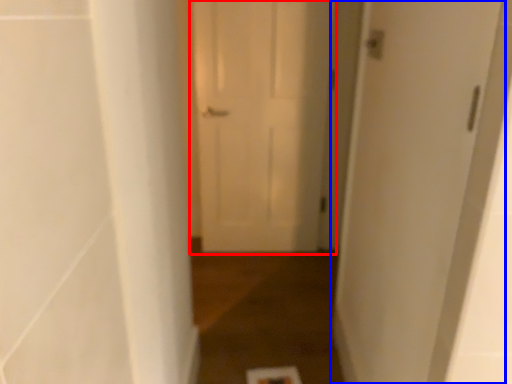
Question: Which point is further to the camera, door (highlighted by a red box) or door (highlighted by a blue box)?

Choices:
 (A) door
 (B) door

Answer: (A)